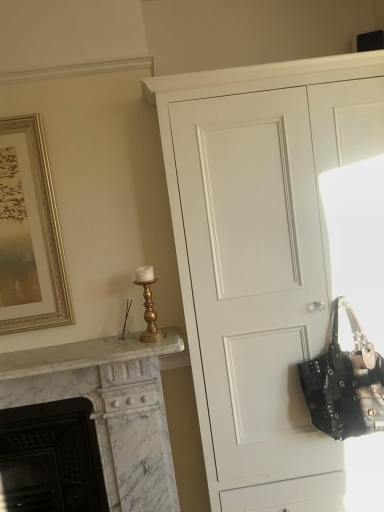
Question: Considering the relative sizes of gold metallic candlestick at upper left and white matte cupboard at center in the image provided, is gold metallic candlestick at upper left smaller than white matte cupboard at center?

Choices:
 (A) no
 (B) yes

Answer: (B)

Question: From the image's perspective, is gold metallic candlestick at upper left below white matte cupboard at center?

Choices:
 (A) no
 (B) yes

Answer: (A)

Question: Does gold metallic candlestick at upper left contain white matte cupboard at center?

Choices:
 (A) no
 (B) yes

Answer: (A)

Question: Considering the relative sizes of gold metallic candlestick at upper left and white matte cupboard at center in the image provided, is gold metallic candlestick at upper left wider than white matte cupboard at center?

Choices:
 (A) yes
 (B) no

Answer: (B)

Question: From a real-world perspective, is gold metallic candlestick at upper left positioned under white matte cupboard at center based on gravity?

Choices:
 (A) yes
 (B) no

Answer: (B)

Question: Is point (165, 482) closer or farther from the camera than point (337, 386)?

Choices:
 (A) farther
 (B) closer

Answer: (A)

Question: From the image's perspective, relative to studded leather handbag at right, is white marble fireplace at left, placed as the second fireplace when sorted from left to right, above or below?

Choices:
 (A) below
 (B) above

Answer: (A)

Question: In terms of height, does white marble fireplace at left, which is counted as the first fireplace, starting from the right, look taller or shorter compared to studded leather handbag at right?

Choices:
 (A) tall
 (B) short

Answer: (A)

Question: Is white marble fireplace at left, placed as the second fireplace when sorted from left to right, in front of or behind studded leather handbag at right in the image?

Choices:
 (A) front
 (B) behind

Answer: (B)

Question: Is gold framed picture at upper left in front of or behind white marble fireplace at left, the 1th fireplace positioned from the left, in the image?

Choices:
 (A) front
 (B) behind

Answer: (A)

Question: In terms of size, does gold framed picture at upper left appear bigger or smaller than white marble fireplace at left, the 2th fireplace when ordered from right to left?

Choices:
 (A) big
 (B) small

Answer: (B)

Question: Considering the relative positions of gold framed picture at upper left and white marble fireplace at left, the 1th fireplace positioned from the left, in the image provided, is gold framed picture at upper left to the left or to the right of white marble fireplace at left, the 1th fireplace positioned from the left,?

Choices:
 (A) left
 (B) right

Answer: (A)

Question: From a real-world perspective, is gold framed picture at upper left physically located above or below white marble fireplace at left, the 1th fireplace positioned from the left?

Choices:
 (A) above
 (B) below

Answer: (A)

Question: Is point (54, 454) closer or farther from the camera than point (367, 416)?

Choices:
 (A) closer
 (B) farther

Answer: (B)

Question: Is white marble fireplace at left, the 1th fireplace positioned from the left, inside the boundaries of studded leather handbag at right, or outside?

Choices:
 (A) inside
 (B) outside

Answer: (B)